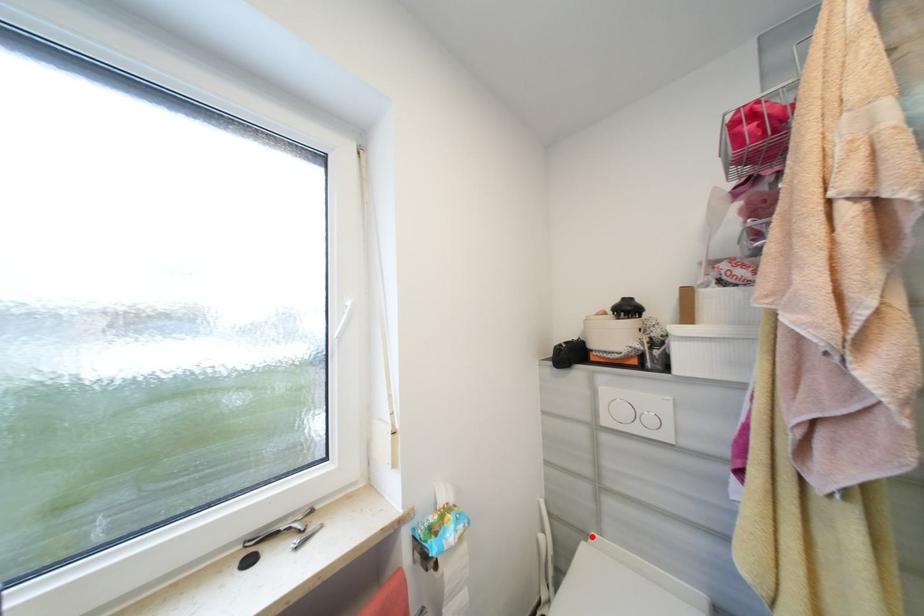
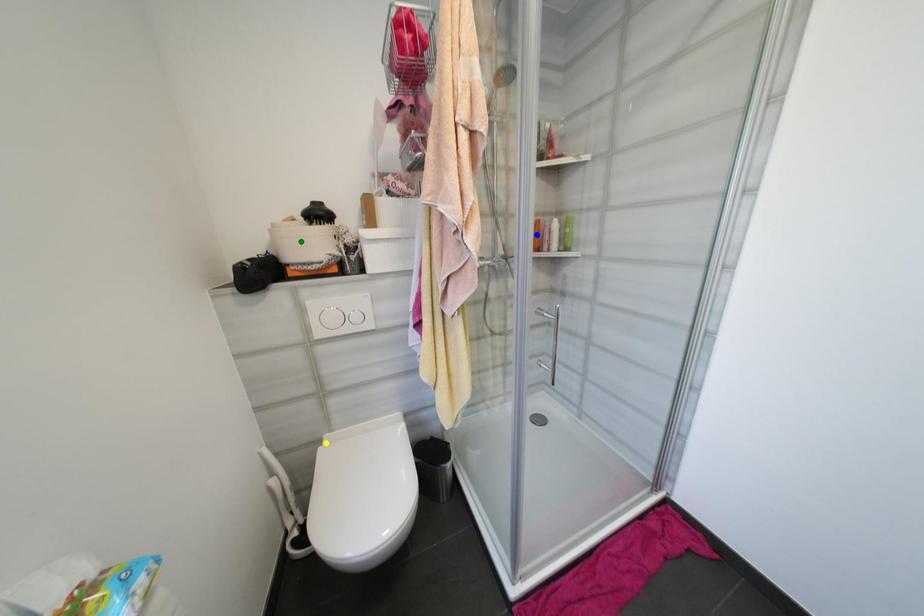
Question: I am providing you with two images of the same scene from different viewpoints. A red point is marked on the first image. You are given multiple points on the second image. Can you choose the point in image 2 that corresponds to the point in image 1?

Choices:
 (A) yellow point
 (B) green point
 (C) blue point

Answer: (A)